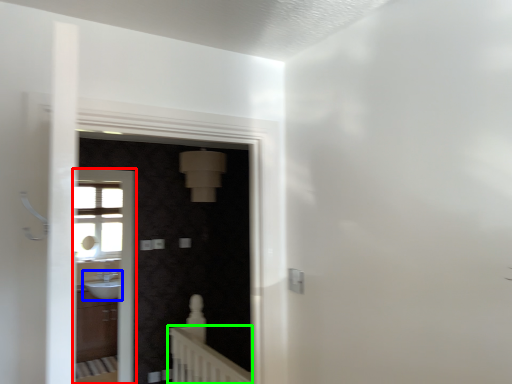
Question: Estimate the real-world distances between objects in this image. Which object is closer to screen door (highlighted by a red box), sink (highlighted by a blue box) or balustrade (highlighted by a green box)?

Choices:
 (A) sink
 (B) balustrade

Answer: (A)